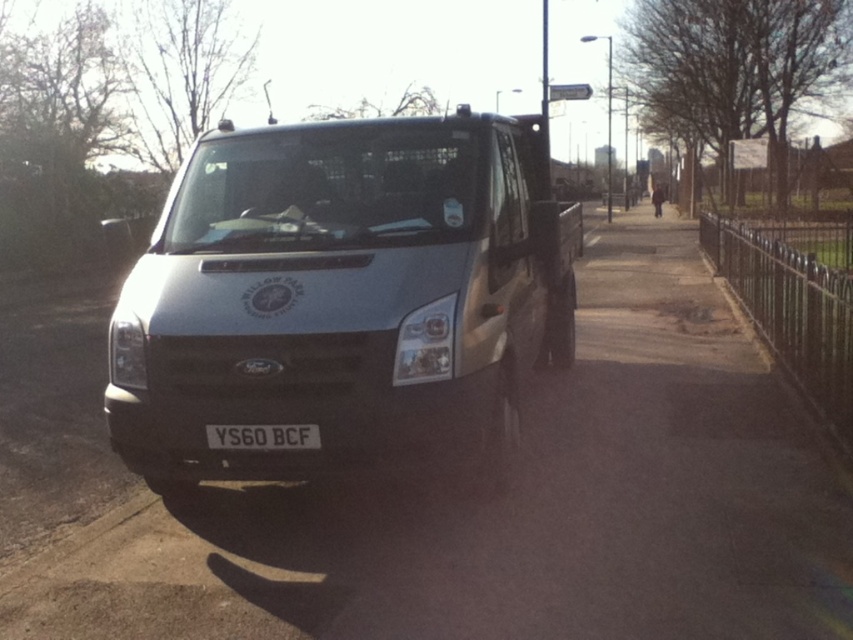
You are a photographer trying to capture the silver metallic van at center and the black plastic license plate at center in a single shot. Since the van is closer to you, will the license plate appear smaller in the photo compared to the van?

Yes, the silver metallic van at center is closer to the viewer than the black plastic license plate at center. Since the van is nearer, the license plate will appear smaller in the photo due to perspective.

You are a delivery driver who needs to park the silver metallic van at center under a low hanging tree branch. The branch is exactly at the height of the black plastic license plate at center. Will the van hit the branch when parking?

The silver metallic van at center is much taller than the black plastic license plate at center. Since the branch is at the license plate height, the van will hit the branch when parking.